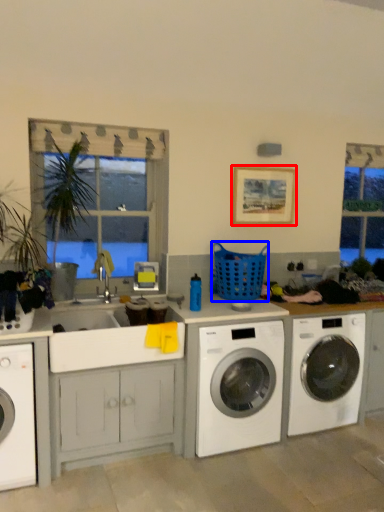
Question: Which object appears closest to the camera in this image, picture frame (highlighted by a red box) or basket (highlighted by a blue box)?

Choices:
 (A) picture frame
 (B) basket

Answer: (B)